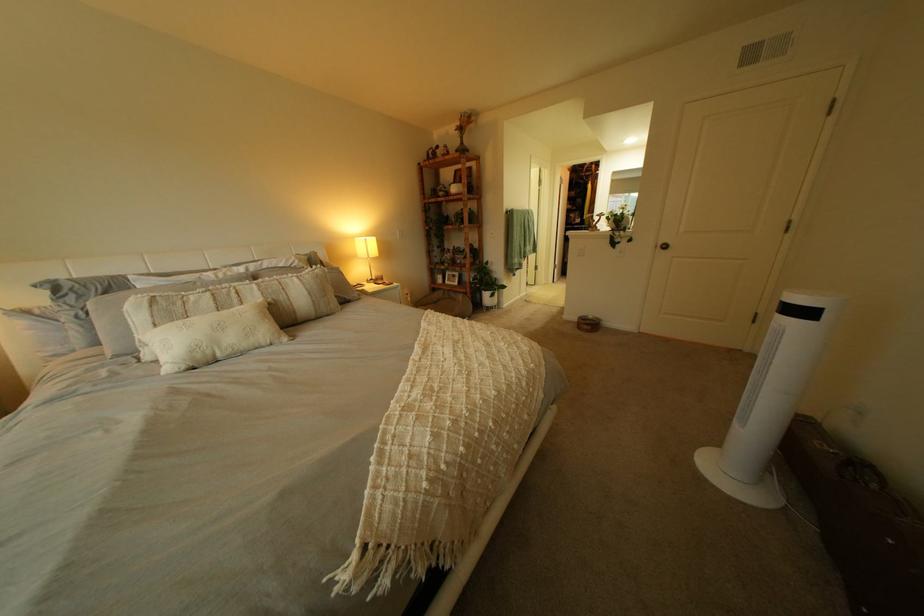
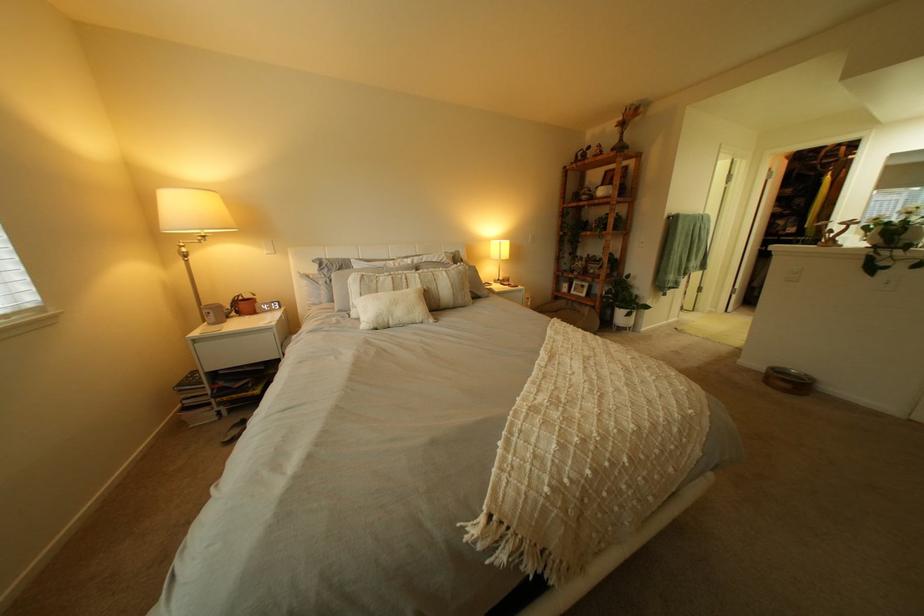
Where in the second image is the point corresponding to the point at 224,353 from the first image?

(400, 320)